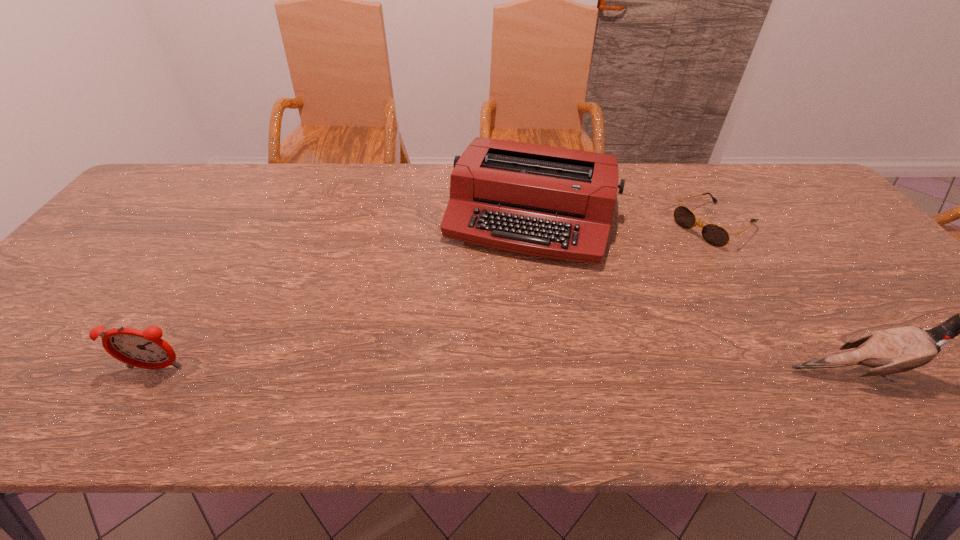
Where is `vacant space located 0.170m on the lenses of the sunglasses`? The width and height of the screenshot is (960, 540). vacant space located 0.170m on the lenses of the sunglasses is located at coordinates (649, 265).

At what (x,y) coordinates should I click in order to perform the action: click on typewriter at the far edge. Please return your answer as a coordinate pair (x, y). This screenshot has width=960, height=540. Looking at the image, I should click on (545, 201).

This screenshot has width=960, height=540. Find the location of `sunglasses at the far edge`. sunglasses at the far edge is located at coordinates tap(715, 235).

The width and height of the screenshot is (960, 540). Find the location of `alarm clock located in the near edge section of the desktop`. alarm clock located in the near edge section of the desktop is located at coordinates (145, 349).

You are a GUI agent. You are given a task and a screenshot of the screen. Output one action in this format:
    pyautogui.click(x=<x>, y=<y>)
    Task: Click on the bird positioned at the near edge
    This screenshot has height=540, width=960.
    Given the screenshot: What is the action you would take?
    tap(896, 350)

This screenshot has width=960, height=540. In order to click on object at the right edge in this screenshot , I will do `click(896, 350)`.

Where is `object that is at the near right corner`? object that is at the near right corner is located at coordinates (896, 350).

What are the coordinates of `vacant space at the far edge` in the screenshot? It's located at (250, 187).

In the image, there is a desktop. In order to click on vacant area at the near edge in this screenshot , I will do click(512, 348).

The height and width of the screenshot is (540, 960). I want to click on vacant space at the left edge of the desktop, so click(12, 336).